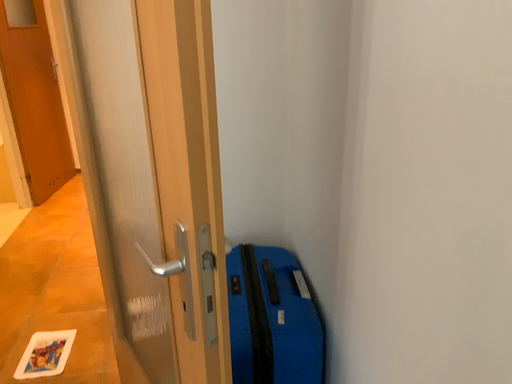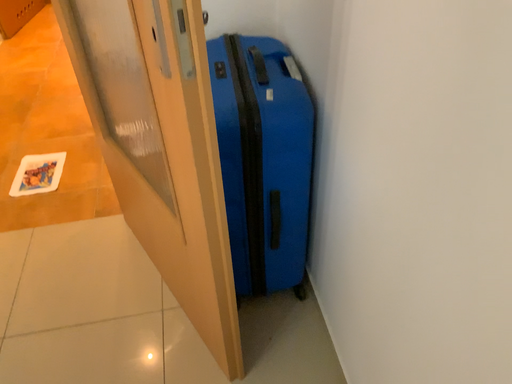
Question: Which way did the camera rotate in the video?

Choices:
 (A) rotated upward
 (B) rotated downward

Answer: (B)